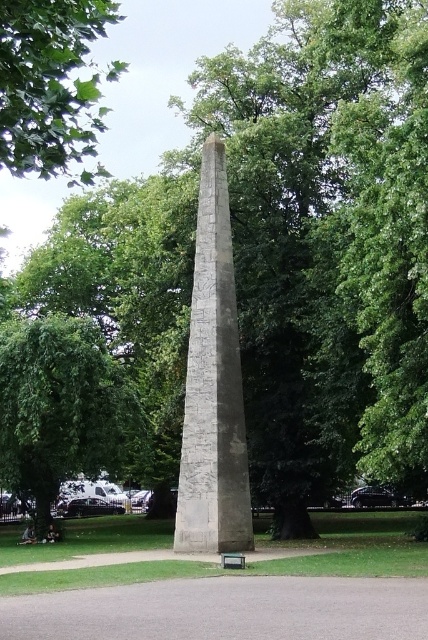
You are standing in the park and want to take a photo of the green leafy tree at upper left and the green painted wood park bench at lower center. Which object should you focus on first if you want both to be in sharp focus?

You should focus on the green leafy tree at upper left first because it is closer to the viewer than the green painted wood park bench at lower center, ensuring both will be in focus when using a camera with depth of field considerations.

You are standing in the park looking at the obelisk. There are two points marked on the obelisk surface. Which point is closer to you, point (x=115, y=369) or point (x=5, y=156)?

Point (x=5, y=156) is closer to you because it is less further to the camera than point (x=115, y=369).

You are sitting on the green painted wood park bench at lower center and want to look at the green leafy tree at upper left. Which direction should you turn your head to see it?

The green leafy tree at upper left is above the green painted wood park bench at lower center, so you should look upwards to see it.